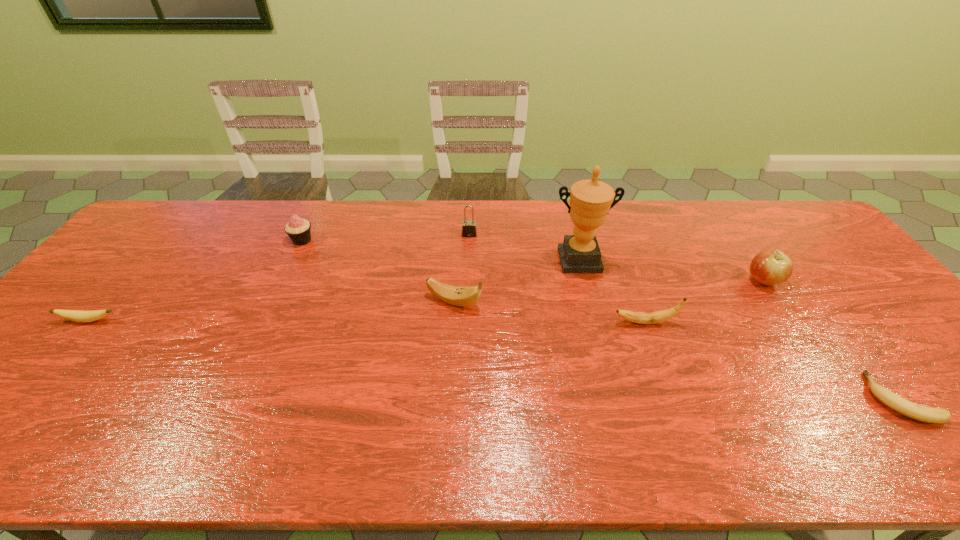
You are a GUI agent. You are given a task and a screenshot of the screen. Output one action in this format:
    pyautogui.click(x=<x>, y=<y>)
    Task: Click on the object that is the second closest to the rightmost banana
    
    Given the screenshot: What is the action you would take?
    pyautogui.click(x=659, y=316)

The height and width of the screenshot is (540, 960). Find the location of `the second closest object to the award`. the second closest object to the award is located at coordinates (458, 296).

Find the location of a particular element. Image resolution: width=960 pixels, height=540 pixels. the closest banana to the leftmost banana is located at coordinates (458, 296).

Identify the location of the second closest banana to the apple. (659, 316).

Where is `free location that satisfies the following two spatial constraints: 1. on the front side of the seventh object from right to left; 2. on the left side of the farthest banana`? This screenshot has width=960, height=540. free location that satisfies the following two spatial constraints: 1. on the front side of the seventh object from right to left; 2. on the left side of the farthest banana is located at coordinates (273, 302).

Identify the location of free spot that satisfies the following two spatial constraints: 1. on the front side of the apple; 2. on the peel of the third banana from left to right from the top. (791, 322).

Image resolution: width=960 pixels, height=540 pixels. What are the coordinates of `free space that satisfies the following two spatial constraints: 1. on the shackle of the padlock; 2. on the right side of the shortest banana` in the screenshot? It's located at (465, 398).